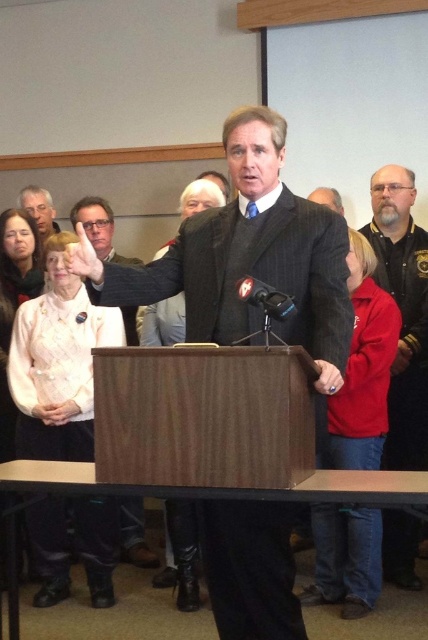
Question: Which point appears farthest from the camera in this image?

Choices:
 (A) (107, 216)
 (B) (246, 609)

Answer: (A)

Question: Among these points, which one is nearest to the camera?

Choices:
 (A) (279, 148)
 (B) (110, 252)
 (C) (332, 188)

Answer: (A)

Question: Does dark brown leather jacket at right have a greater width compared to matte black suit at center?

Choices:
 (A) yes
 (B) no

Answer: (A)

Question: Can you confirm if dark gray pinstripe suit at center is smaller than matte gray suit at upper left?

Choices:
 (A) no
 (B) yes

Answer: (A)

Question: Which object is closer to the camera taking this photo?

Choices:
 (A) matte gray suit at upper left
 (B) dark gray pinstripe suit at center
 (C) matte black suit at center

Answer: (B)

Question: Considering the relative positions of dark brown leather jacket at right and matte gray suit at upper left in the image provided, where is dark brown leather jacket at right located with respect to matte gray suit at upper left?

Choices:
 (A) left
 (B) right

Answer: (B)